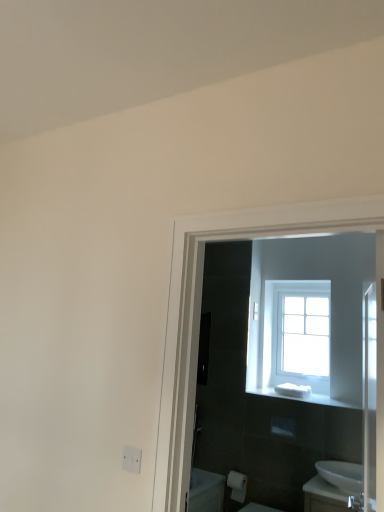
Question: Considering the relative sizes of white glossy sink at lower right and clear glass window at upper center in the image provided, is white glossy sink at lower right smaller than clear glass window at upper center?

Choices:
 (A) yes
 (B) no

Answer: (A)

Question: From the image's perspective, is white glossy sink at lower right located beneath clear glass window at upper center?

Choices:
 (A) no
 (B) yes

Answer: (B)

Question: Considering the relative sizes of white glossy sink at lower right and clear glass window at upper center in the image provided, is white glossy sink at lower right taller than clear glass window at upper center?

Choices:
 (A) yes
 (B) no

Answer: (B)

Question: Considering the relative sizes of white glossy sink at lower right and clear glass window at upper center in the image provided, is white glossy sink at lower right thinner than clear glass window at upper center?

Choices:
 (A) no
 (B) yes

Answer: (A)

Question: Is white glossy sink at lower right at the right side of clear glass window at upper center?

Choices:
 (A) no
 (B) yes

Answer: (B)

Question: Considering the relative sizes of white glossy sink at lower right and clear glass window at upper center in the image provided, is white glossy sink at lower right bigger than clear glass window at upper center?

Choices:
 (A) no
 (B) yes

Answer: (A)

Question: From a real-world perspective, is white glossy sink at lower right under white matte electric outlet at lower left?

Choices:
 (A) yes
 (B) no

Answer: (A)

Question: Can you confirm if white glossy sink at lower right is thinner than white matte electric outlet at lower left?

Choices:
 (A) no
 (B) yes

Answer: (A)

Question: Does white glossy sink at lower right lie behind white matte electric outlet at lower left?

Choices:
 (A) no
 (B) yes

Answer: (B)

Question: From a real-world perspective, is white glossy sink at lower right on white matte electric outlet at lower left?

Choices:
 (A) yes
 (B) no

Answer: (B)

Question: Could you tell me if white glossy sink at lower right is turned towards white matte electric outlet at lower left?

Choices:
 (A) no
 (B) yes

Answer: (B)

Question: From the image's perspective, is white glossy sink at lower right below white matte electric outlet at lower left?

Choices:
 (A) no
 (B) yes

Answer: (B)

Question: Is white glossy sink at lower right at the back of white matte toilet paper at lower center?

Choices:
 (A) yes
 (B) no

Answer: (B)